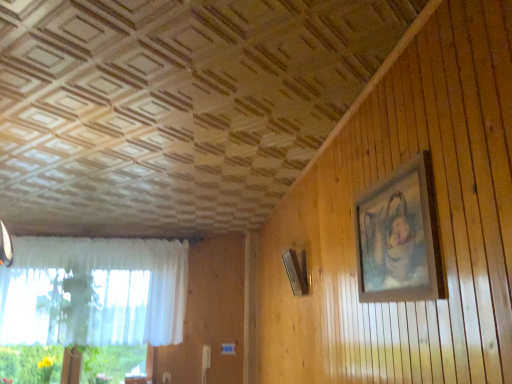
Question: Would you say wooden picture frame at upper right is to the left or to the right of white sheer curtain at left in the picture?

Choices:
 (A) left
 (B) right

Answer: (B)

Question: From the image's perspective, is wooden picture frame at upper right located above or below white sheer curtain at left?

Choices:
 (A) above
 (B) below

Answer: (A)

Question: Considering the positions of point (356, 211) and point (178, 281), is point (356, 211) closer or farther from the camera than point (178, 281)?

Choices:
 (A) farther
 (B) closer

Answer: (B)

Question: In the image, is white sheer curtain at left positioned in front of or behind wooden picture frame at upper right?

Choices:
 (A) front
 (B) behind

Answer: (B)

Question: In the image, is white sheer curtain at left on the left side or the right side of wooden picture frame at upper right?

Choices:
 (A) left
 (B) right

Answer: (A)

Question: Does point (16, 327) appear closer or farther from the camera than point (430, 201)?

Choices:
 (A) farther
 (B) closer

Answer: (A)

Question: Is white sheer curtain at left wider or thinner than wooden picture frame at upper right?

Choices:
 (A) wide
 (B) thin

Answer: (A)